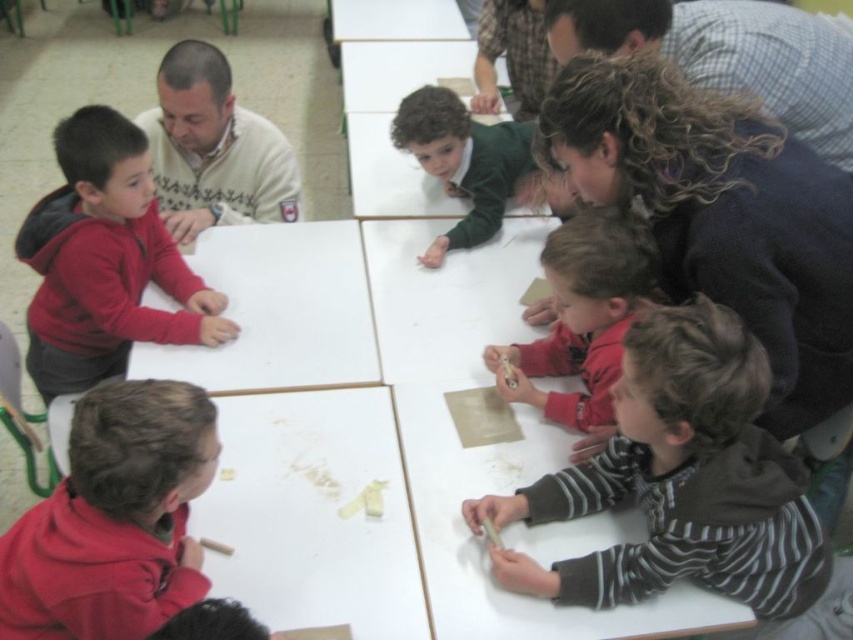
Question: Which point appears closest to the camera in this image?

Choices:
 (A) (409, 1)
 (B) (111, 145)
 (C) (751, 13)
 (D) (212, 77)

Answer: (B)

Question: Which point is farther from the camera taking this photo?

Choices:
 (A) (248, 310)
 (B) (312, 624)
 (C) (639, 12)
 (D) (463, 280)

Answer: (D)

Question: Is striped fabric shirt at lower right behind matte red hoodie at lower left?

Choices:
 (A) yes
 (B) no

Answer: (A)

Question: Which point is closer to the camera taking this photo?

Choices:
 (A) (120, 145)
 (B) (230, 147)
 (C) (235, 573)

Answer: (C)

Question: Can you confirm if white paper at center is smaller than white sweater at upper left?

Choices:
 (A) no
 (B) yes

Answer: (A)

Question: In this image, where is white matte table at lower left located relative to white paper at center?

Choices:
 (A) below
 (B) above

Answer: (A)